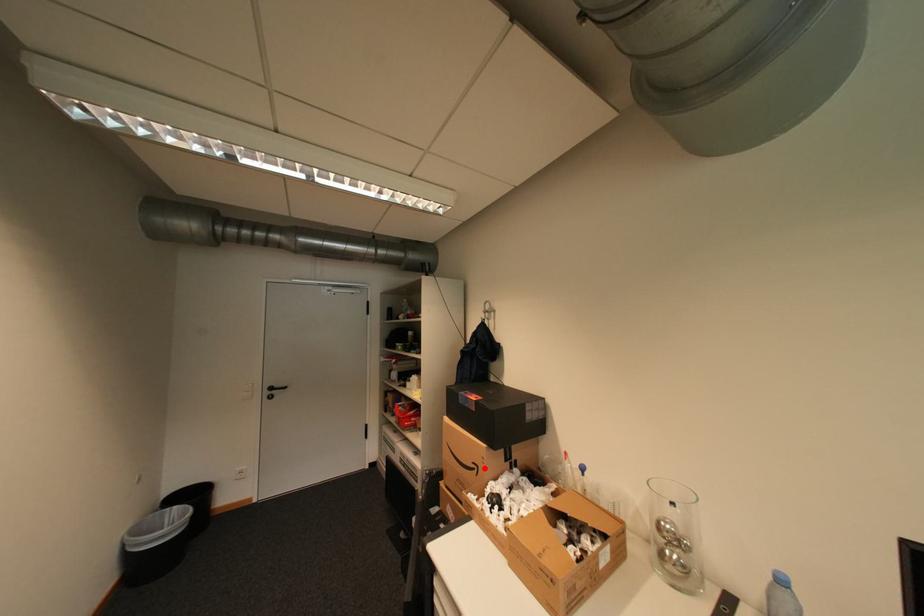
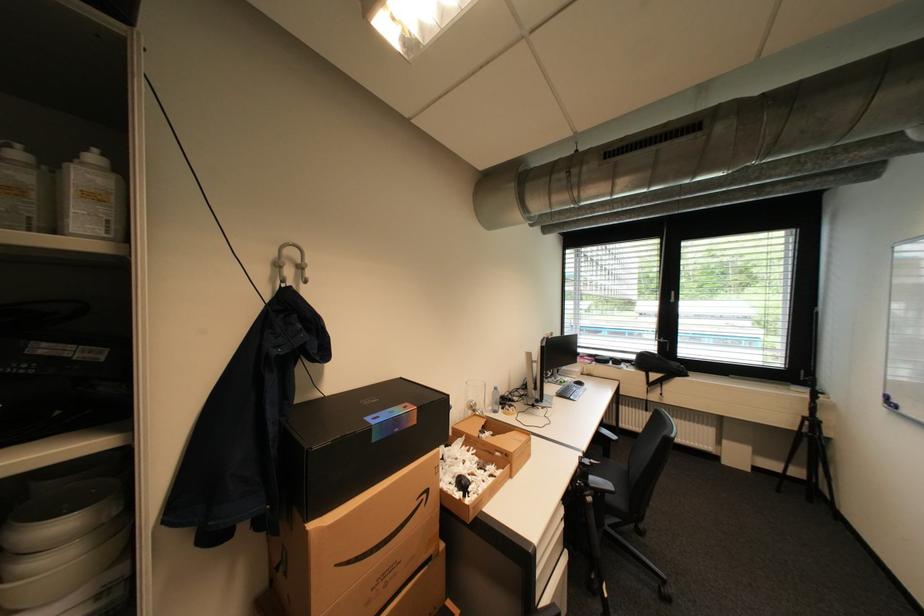
Question: I am providing you with two images of the same scene from different viewpoints. Image1 has a red point marked. In image2, the corresponding 3D location appears at what relative position? Reply with the corresponding letter.

Choices:
 (A) Closer
 (B) Farther

Answer: (A)